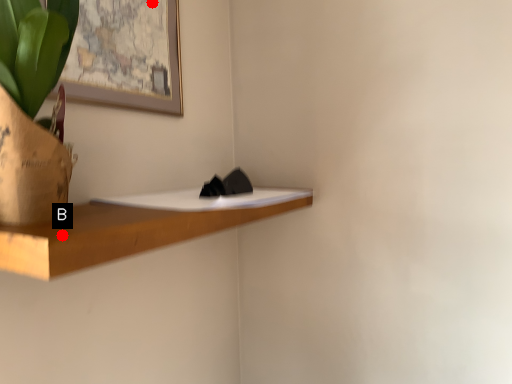
Question: Two points are circled on the image, labeled by A and B beside each circle. Which point is closer to the camera?

Choices:
 (A) A is closer
 (B) B is closer

Answer: (B)